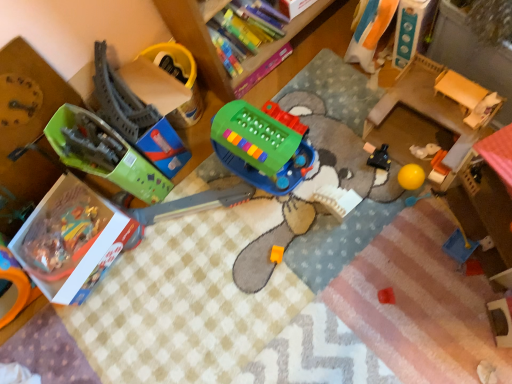
This screenshot has width=512, height=384. I want to click on vacant space in front of white cardboard box at left, which is counted as the second box, starting from the top, so click(115, 321).